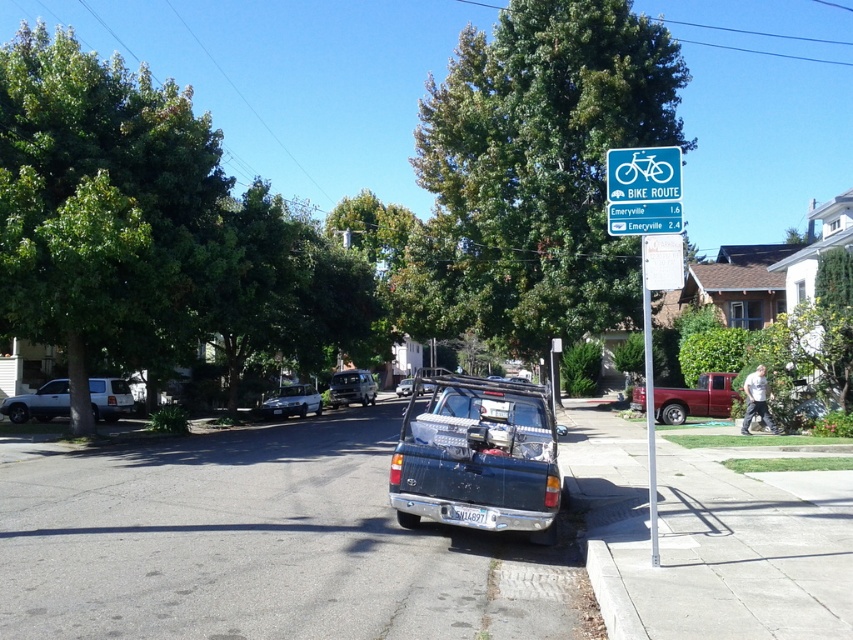
Question: Which is nearer to the blue plastic sign at upper right?

Choices:
 (A) matte red pickup truck at center-right
 (B) white matte suv at left
 (C) green leafy tree at upper center

Answer: (A)

Question: Is matte black truck at center positioned before blue plastic sign at upper right?

Choices:
 (A) no
 (B) yes

Answer: (A)

Question: Which of these objects is positioned farthest from the white plastic license plate at center?

Choices:
 (A) white matte suv at left
 (B) metallic silver pole at right
 (C) blue plastic bike route sign at upper right
 (D) green leafy tree at left

Answer: (A)

Question: Observing the image, what is the correct spatial positioning of blue plastic sign at upper right in reference to satin silver sedan at center?

Choices:
 (A) below
 (B) above

Answer: (B)

Question: Does metallic silver pole at right lie behind satin silver sedan at center?

Choices:
 (A) yes
 (B) no

Answer: (B)

Question: Which object appears farthest from the camera in this image?

Choices:
 (A) blue plastic sign at upper right
 (B) green leafy tree at upper center

Answer: (B)